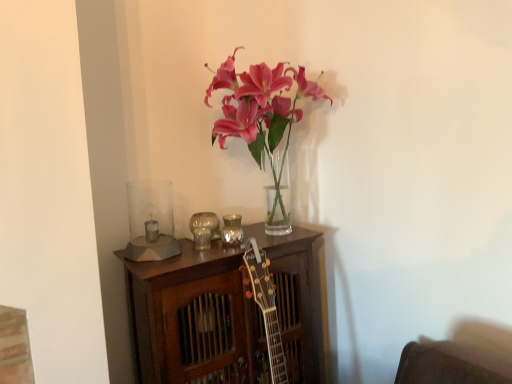
Question: Considering the positions of metallic reflective candle holder at center, acting as the first candle holder starting from the right, and metallic silver candle holder at center, acting as the second candle holder starting from the right, in the image, is metallic reflective candle holder at center, acting as the first candle holder starting from the right, taller or shorter than metallic silver candle holder at center, acting as the second candle holder starting from the right,?

Choices:
 (A) tall
 (B) short

Answer: (B)

Question: In the image, is metallic reflective candle holder at center, acting as the first candle holder starting from the right, positioned in front of or behind metallic silver candle holder at center, the 2th candle holder viewed from the left?

Choices:
 (A) front
 (B) behind

Answer: (B)

Question: Which object is the closest to the metallic reflective candle holder at center, acting as the first candle holder starting from the right?

Choices:
 (A) clear glass candle holder at left, acting as the third candle holder starting from the right
 (B) metallic silver candle holder at center, the 2th candle holder viewed from the left

Answer: (B)

Question: Considering the real-world distances, which object is closest to the metallic reflective candle holder at center, which ranks as the 3th candle holder in left-to-right order?

Choices:
 (A) clear glass candle holder at left, acting as the third candle holder starting from the right
 (B) metallic silver candle holder at center, acting as the second candle holder starting from the right

Answer: (B)